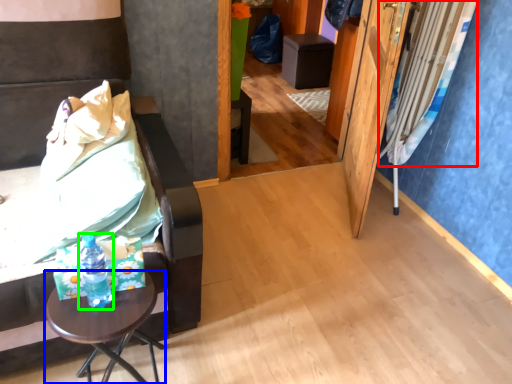
Question: Estimate the real-world distances between objects in this image. Which object is farther from curtain (highlighted by a red box), table (highlighted by a blue box) or bottle (highlighted by a green box)?

Choices:
 (A) table
 (B) bottle

Answer: (B)